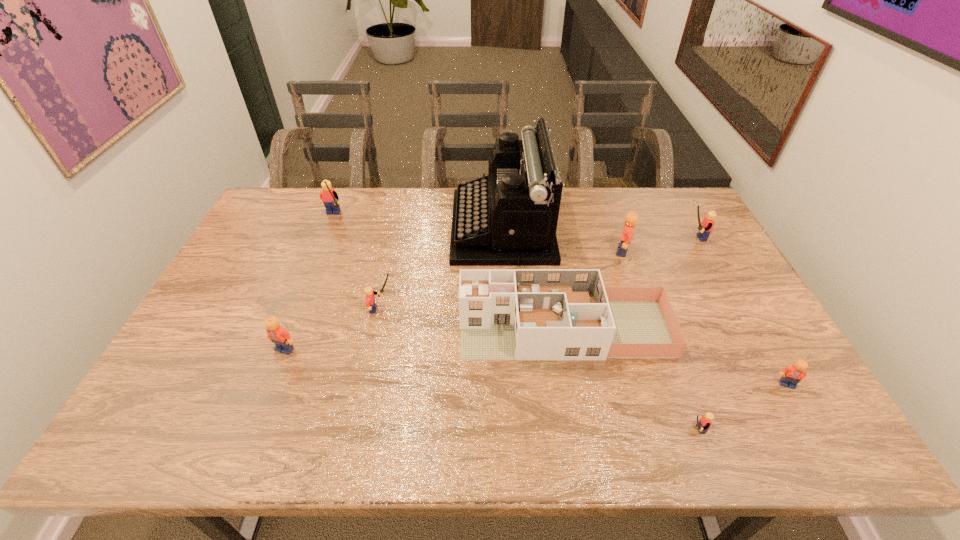
Image resolution: width=960 pixels, height=540 pixels. What are the coordinates of `vacant position located 0.300m on the front-facing side of the second tallest object` in the screenshot? It's located at (303, 289).

Identify the location of vacant space situated 0.230m on the front-facing side of the farthest orange Lego. The image size is (960, 540). (543, 251).

Find the location of a particular element. This screenshot has height=540, width=960. vacant space located on the front-facing side of the farthest orange Lego is located at coordinates (524, 251).

The width and height of the screenshot is (960, 540). Find the location of `vacant space located 0.100m on the front-facing side of the farthest orange Lego`. vacant space located 0.100m on the front-facing side of the farthest orange Lego is located at coordinates (584, 251).

Image resolution: width=960 pixels, height=540 pixels. What are the coordinates of `vacant point located 0.280m on the front-facing side of the third nearest yellow Lego` in the screenshot? It's located at (596, 238).

Image resolution: width=960 pixels, height=540 pixels. In order to click on free space located on the front-facing side of the third nearest yellow Lego in this screenshot , I will do `click(626, 238)`.

Locate an element on the screen. vacant area located on the front-facing side of the third nearest yellow Lego is located at coordinates 612,238.

The height and width of the screenshot is (540, 960). Find the location of `free spot located at the entrance of the dollhouse`. free spot located at the entrance of the dollhouse is located at coordinates (364, 329).

You are a GUI agent. You are given a task and a screenshot of the screen. Output one action in this format:
    pyautogui.click(x=<x>, y=<y>)
    Task: Click on the free space located at the entrance of the dollhouse
    The height and width of the screenshot is (540, 960).
    Given the screenshot: What is the action you would take?
    pyautogui.click(x=374, y=329)

This screenshot has height=540, width=960. In order to click on vacant region located at the entrance of the dollhouse in this screenshot , I will do `click(326, 329)`.